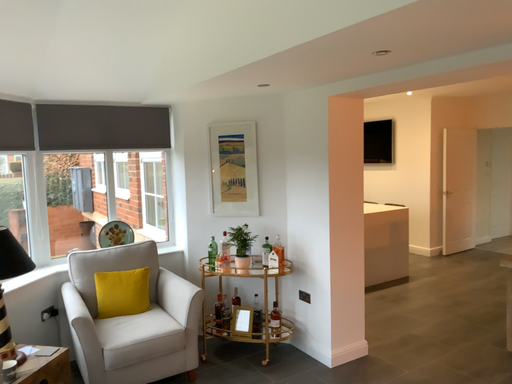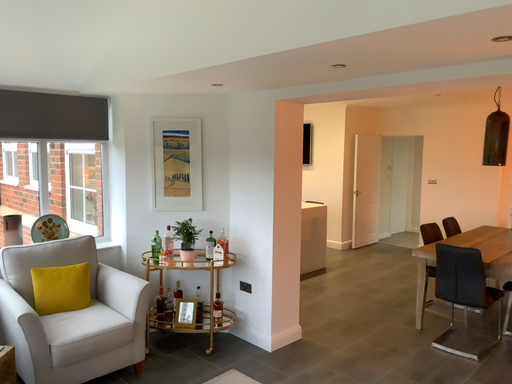
Question: How did the camera likely rotate when shooting the video?

Choices:
 (A) rotated right
 (B) rotated left

Answer: (A)